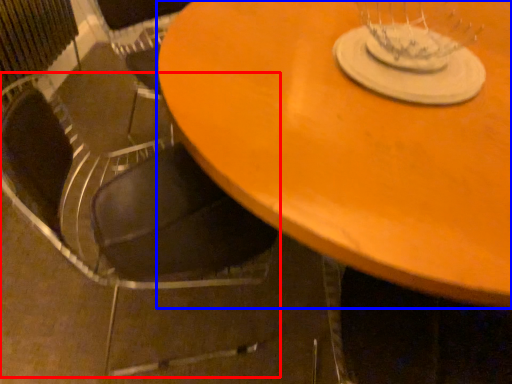
Question: Among these objects, which one is nearest to the camera, chair (highlighted by a red box) or table (highlighted by a blue box)?

Choices:
 (A) chair
 (B) table

Answer: (B)